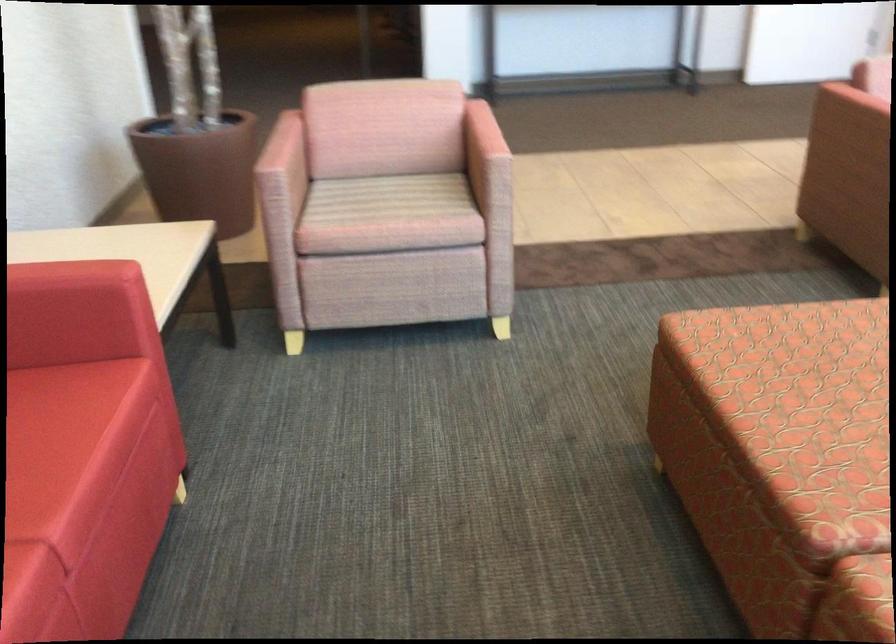
What do you see at coordinates (38, 408) in the screenshot?
I see `the red sofa sitting surface` at bounding box center [38, 408].